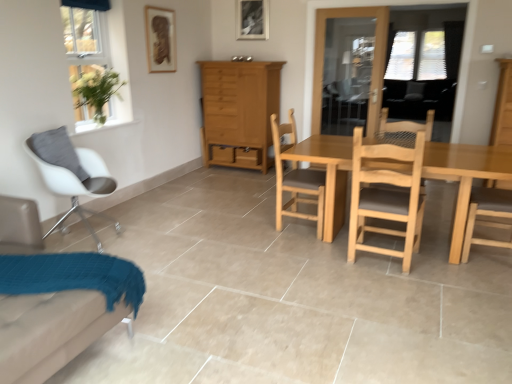
Identify the location of free space above clear glass window at upper left (from a real-world perspective). Image resolution: width=512 pixels, height=384 pixels. tap(83, 1).